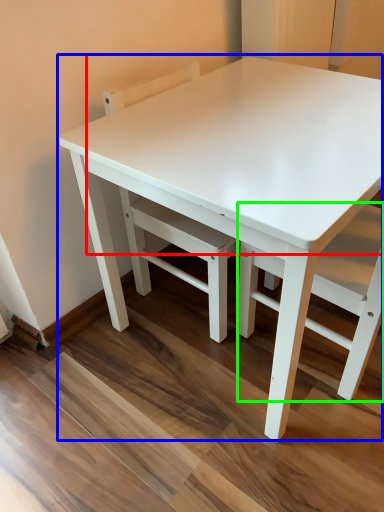
Question: Which is farther away from table top (highlighted by a red box)? table (highlighted by a blue box) or chair (highlighted by a green box)?

Choices:
 (A) table
 (B) chair

Answer: (B)